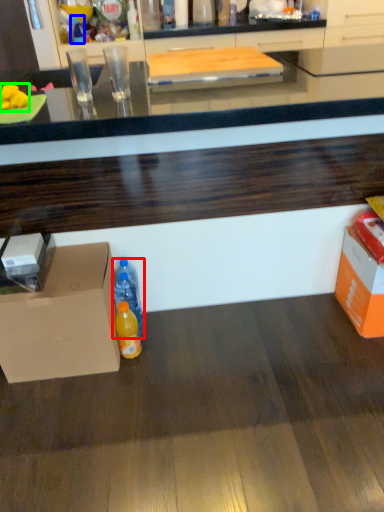
Question: Estimate the real-world distances between objects in this image. Which object is closer to bottle (highlighted by a red box), bottle (highlighted by a blue box) or food (highlighted by a green box)?

Choices:
 (A) bottle
 (B) food

Answer: (B)